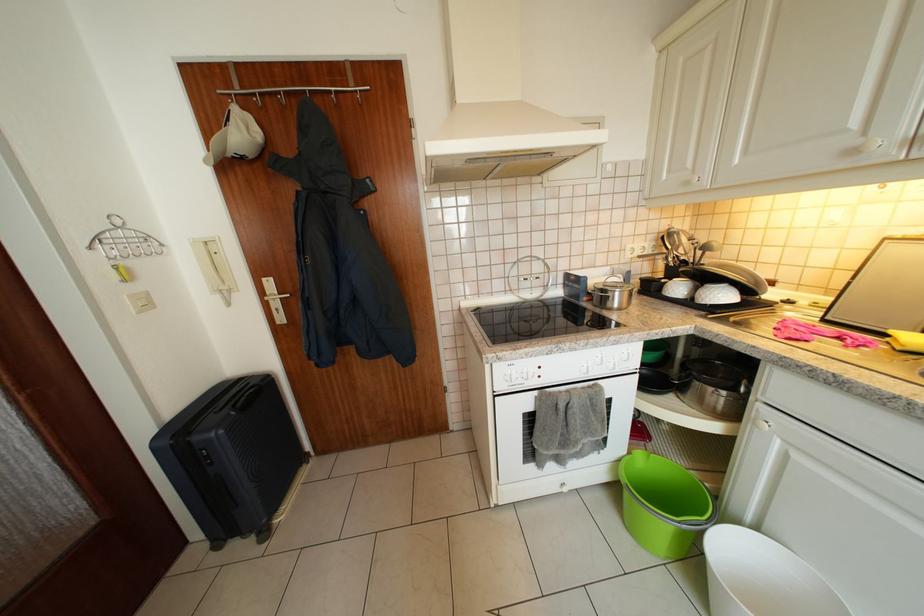
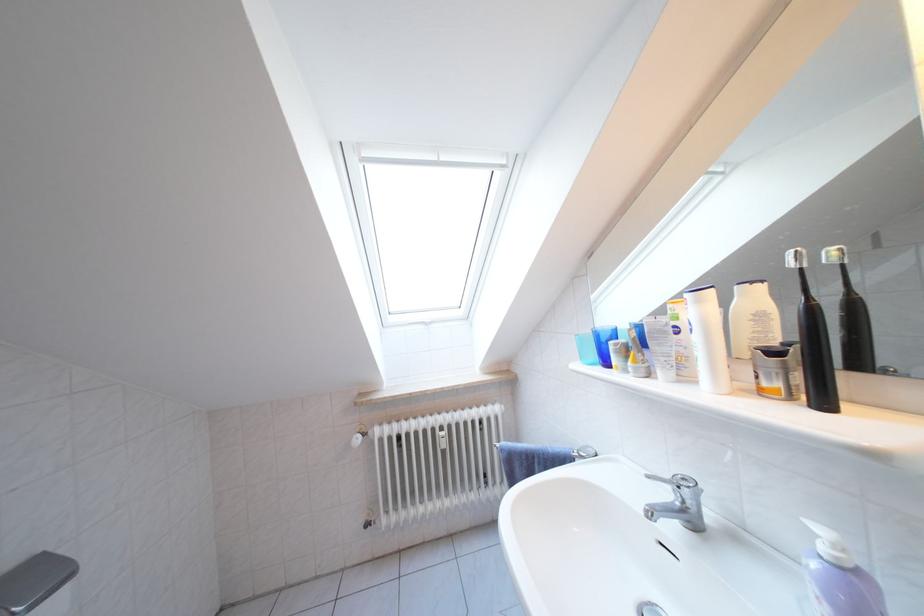
Question: What movement of the cameraman would produce the second image?

Choices:
 (A) Left
 (B) Right
 (C) Forward
 (D) Backward

Answer: (B)